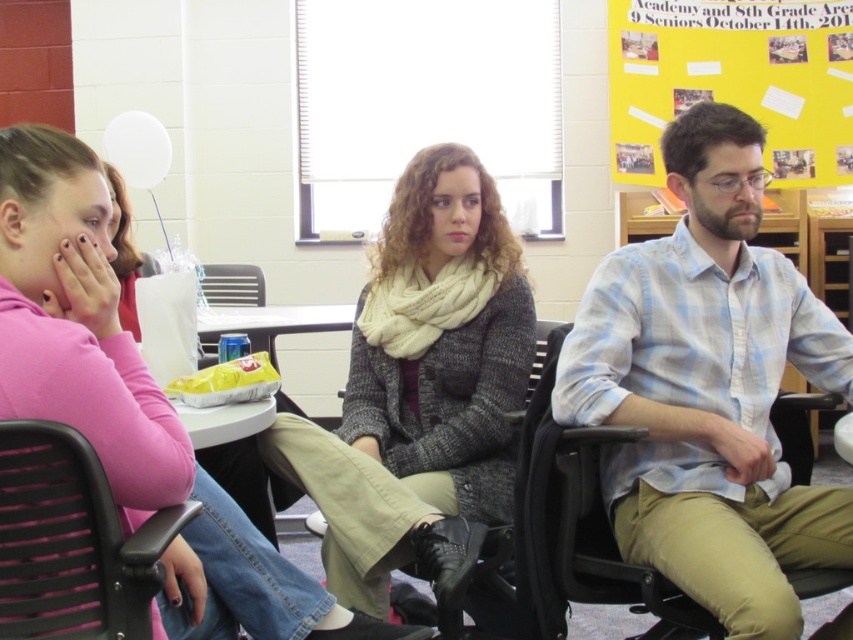
What are the coordinates of the light blue plaid shirt at center in the image?

The coordinates of the light blue plaid shirt at center are at point (709, 388).

You are organizing a school event and need to decide which item to place on a small table. The pink fabric shirt at left and the yellow paper at upper right are both candidates. Based on their sizes, which one would you choose for the table?

The yellow paper at upper right is smaller in size than the pink fabric shirt at left, so it would be more suitable for placing on a small table.

You are an observer in the classroom. You notice the knitted cream scarf at center and the yellow paper at upper right. Which object is positioned higher in the image?

The knitted cream scarf at center is much taller than the yellow paper at upper right, so the knitted cream scarf at center is positioned higher in the image.